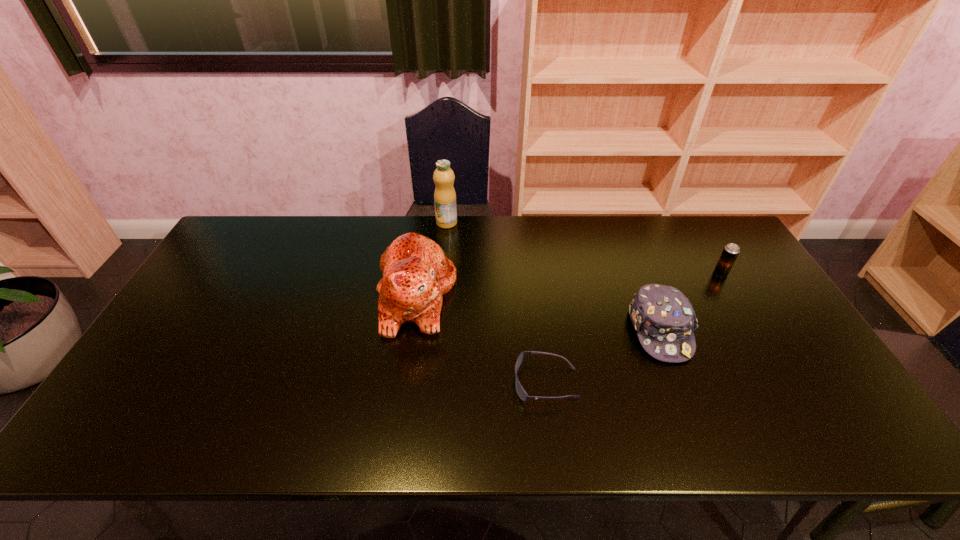
Find the location of a particular element. This screenshot has height=540, width=960. fruit juice is located at coordinates (444, 196).

You are a GUI agent. You are given a task and a screenshot of the screen. Output one action in this format:
    pyautogui.click(x=<x>, y=<y>)
    Task: Click on the cat
    
    Given the screenshot: What is the action you would take?
    pyautogui.click(x=416, y=273)

You are a GUI agent. You are given a task and a screenshot of the screen. Output one action in this format:
    pyautogui.click(x=<x>, y=<y>)
    Task: Click on the headwear
    
    Given the screenshot: What is the action you would take?
    pyautogui.click(x=665, y=321)

Find the location of a particular element. the rightmost object is located at coordinates (731, 251).

This screenshot has height=540, width=960. What are the coordinates of `the shortest object` in the screenshot? It's located at (522, 394).

This screenshot has height=540, width=960. Identify the location of sunglasses. (522, 394).

Identify the location of vacant area situated on the front label of the fruit juice. (442, 282).

Find the location of a particular element. vacant space situated on the face of the cat is located at coordinates tap(476, 296).

This screenshot has width=960, height=540. Identify the location of free space located on the front-facing side of the fourth object from left to right. (687, 399).

Identify the location of vacant space located on the front of the beer can. This screenshot has width=960, height=540. (776, 365).